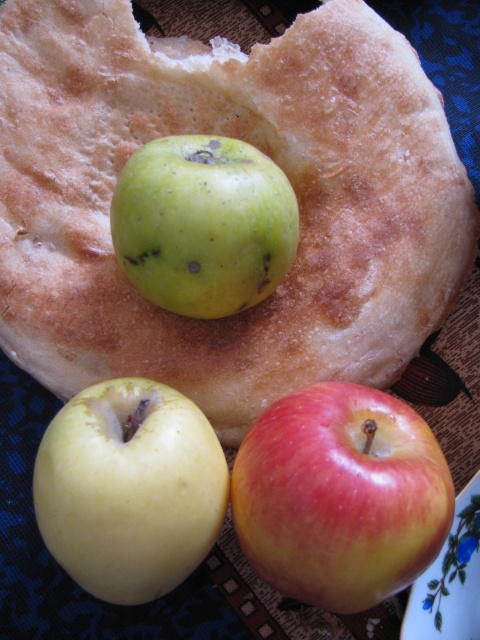
Question: Which of the following is the farthest from the observer?

Choices:
 (A) red-yellow smooth apple at lower right
 (B) green matte apple at upper center

Answer: (B)

Question: Does green matte apple at upper center have a smaller size compared to green matte apple at center?

Choices:
 (A) no
 (B) yes

Answer: (A)

Question: Does red-yellow smooth apple at lower right have a lesser width compared to yellow matte apple at center?

Choices:
 (A) no
 (B) yes

Answer: (A)

Question: Which of the following is the closest to the observer?

Choices:
 (A) (239, 257)
 (B) (127, 472)
 (C) (325, 113)

Answer: (B)

Question: Which is nearer to the yellow matte apple at center?

Choices:
 (A) red-yellow smooth apple at lower right
 (B) green matte apple at upper center
 (C) green matte apple at center

Answer: (A)

Question: Is red-yellow smooth apple at lower right to the right of yellow matte apple at center from the viewer's perspective?

Choices:
 (A) no
 (B) yes

Answer: (B)